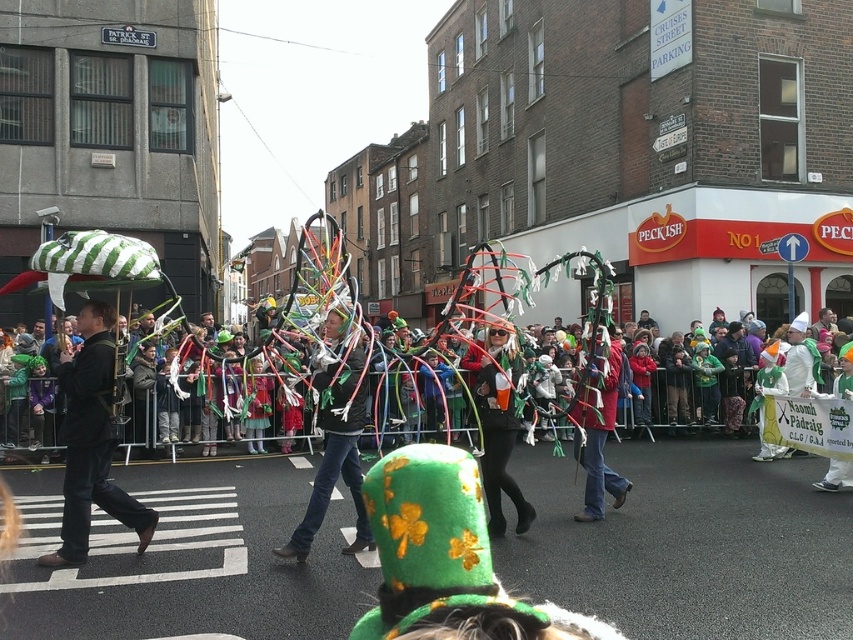
Is green fabric crowd at center in front of green fabric hat at center?

Yes, green fabric crowd at center is closer to the viewer.

Can you confirm if green fabric crowd at center is wider than green fabric hat at center?

Yes, green fabric crowd at center is wider than green fabric hat at center.

Does point (236, 380) come behind point (328, 429)?

Yes, point (236, 380) is behind point (328, 429).

Locate an element on the screen. The height and width of the screenshot is (640, 853). green fabric crowd at center is located at coordinates (149, 404).

Is the position of green fabric hat at center less distant than that of green felt hat at center?

Yes, it is.

Is point (294, 545) positioned in front of point (503, 525)?

Yes, it is in front of point (503, 525).

Find the location of a particular element. green fabric hat at center is located at coordinates (335, 452).

You are a GUI agent. You are given a task and a screenshot of the screen. Output one action in this format:
    pyautogui.click(x=<x>, y=<y>)
    Task: Click on the green fabric hat at center
    The height and width of the screenshot is (640, 853).
    Given the screenshot: What is the action you would take?
    pyautogui.click(x=335, y=452)

In the scene shown: Is matte black jacket at left behind green fabric hat at center?

No, matte black jacket at left is closer to the viewer.

Is point (126, 509) positioned behind point (329, 403)?

Yes, point (126, 509) is behind point (329, 403).

You are a GUI agent. You are given a task and a screenshot of the screen. Output one action in this format:
    pyautogui.click(x=<x>, y=<y>)
    Task: Click on the matte black jacket at left
    The image size is (853, 640).
    Given the screenshot: What is the action you would take?
    pyautogui.click(x=91, y=442)